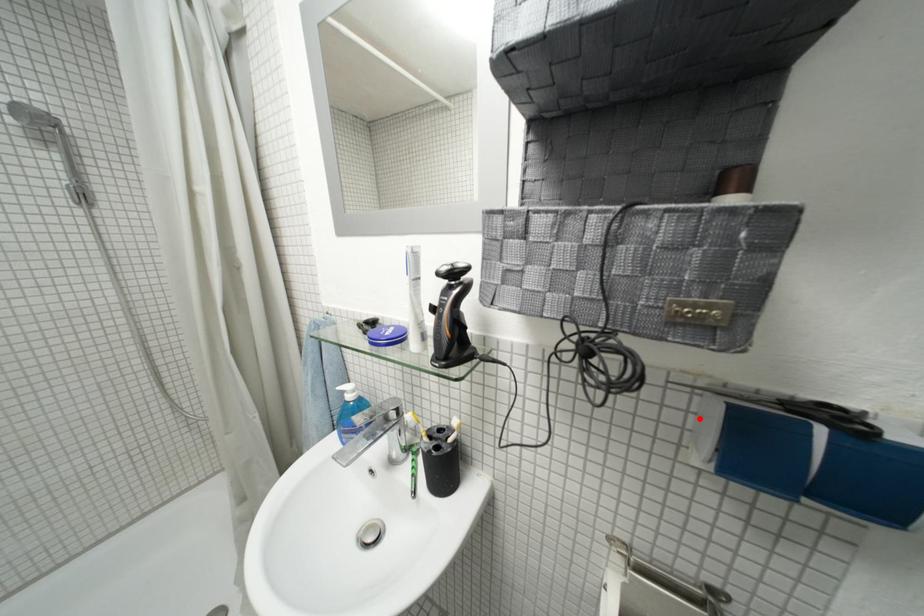
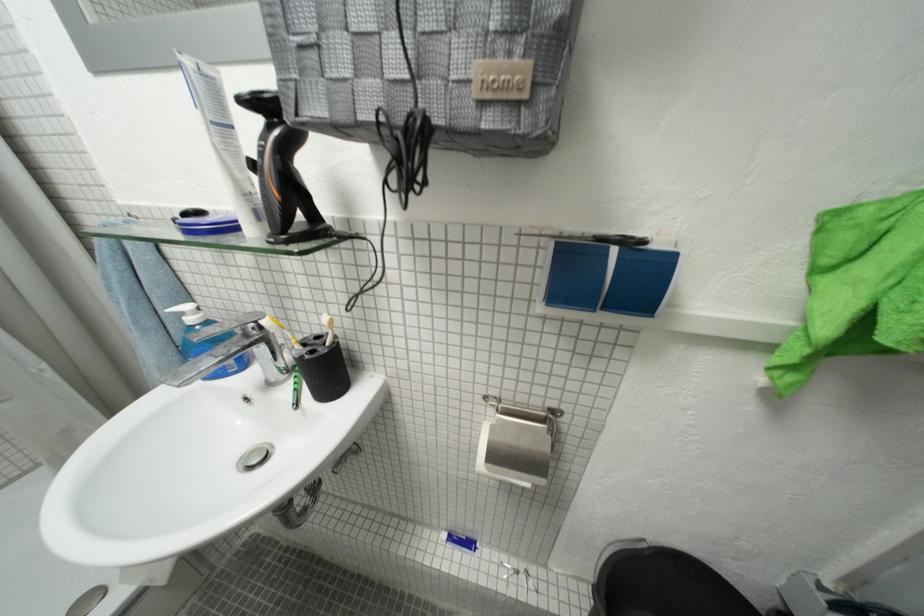
Locate, in the second image, the point that corresponds to the highlighted location in the first image.

(546, 273)